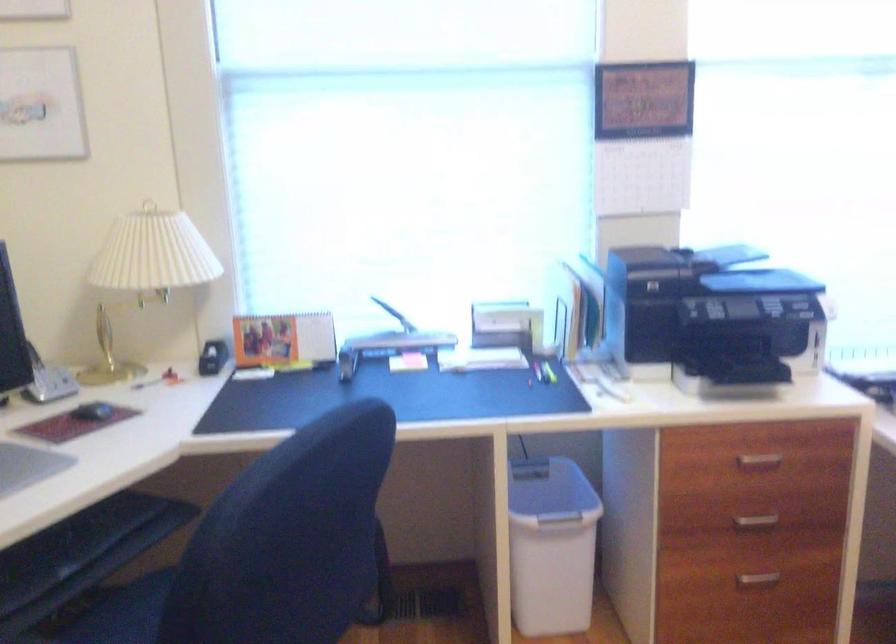
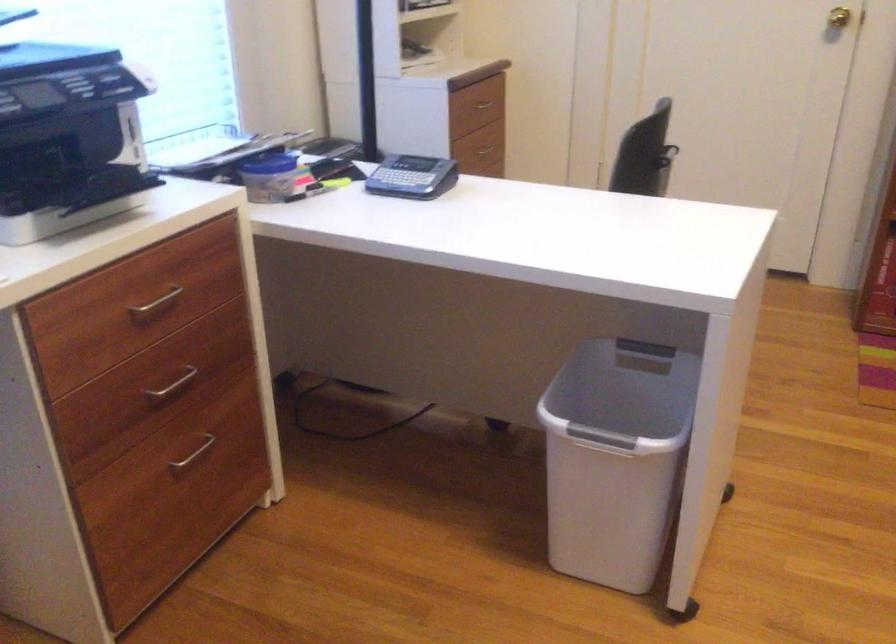
In the second image, find the point that corresponds to (754,521) in the first image.

(173, 384)